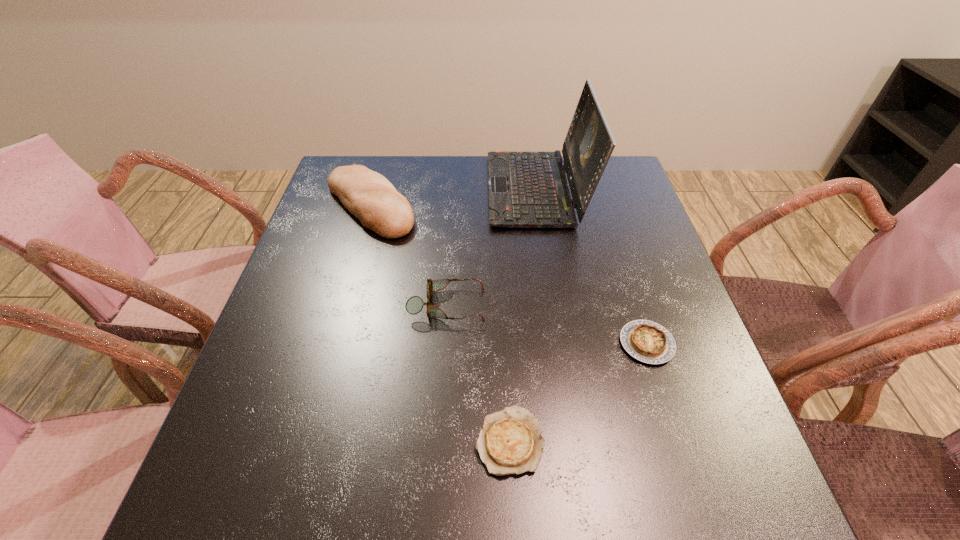
The width and height of the screenshot is (960, 540). Identify the location of empty space between the third shortest object and the leftmost object. (408, 254).

Find the location of a particular element. The width and height of the screenshot is (960, 540). vacant region between the spectacles and the right quiche is located at coordinates (547, 324).

The image size is (960, 540). In order to click on free spot between the third tallest object and the right quiche in this screenshot , I will do `click(547, 324)`.

This screenshot has height=540, width=960. I want to click on vacant area between the tallest object and the shorter quiche, so click(x=523, y=315).

Where is `free point between the taller quiche and the leftmost object`? free point between the taller quiche and the leftmost object is located at coordinates (509, 274).

Where is `unoccupied area between the third tallest object and the leftmost object`? This screenshot has height=540, width=960. unoccupied area between the third tallest object and the leftmost object is located at coordinates (408, 254).

This screenshot has width=960, height=540. Find the location of `free space between the right quiche and the third tallest object`. free space between the right quiche and the third tallest object is located at coordinates (547, 324).

Point out which object is positioned as the second nearest to the shorter quiche. Please provide its 2D coordinates. Your answer should be formatted as a tuple, i.e. [(x, y)], where the tuple contains the x and y coordinates of a point satisfying the conditions above.

[(646, 341)]

At what (x,y) coordinates should I click in order to perform the action: click on object that stands as the third closest to the spectacles. Please return your answer as a coordinate pair (x, y). This screenshot has height=540, width=960. Looking at the image, I should click on (x=526, y=189).

Locate an element on the screen. The image size is (960, 540). free space that satisfies the following two spatial constraints: 1. on the screen of the tallest object; 2. on the front side of the bread is located at coordinates (539, 205).